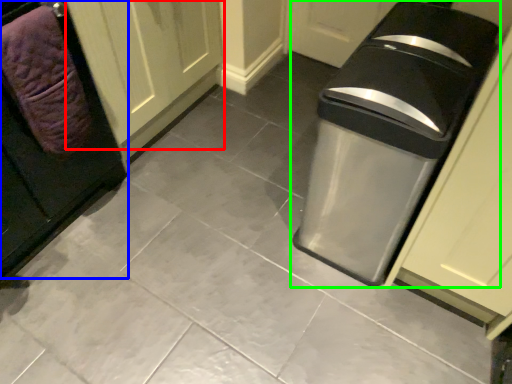
Question: Which object is positioned closest to door (highlighted by a red box)? Select from cabinetry (highlighted by a blue box) and waste container (highlighted by a green box).

Choices:
 (A) cabinetry
 (B) waste container

Answer: (A)